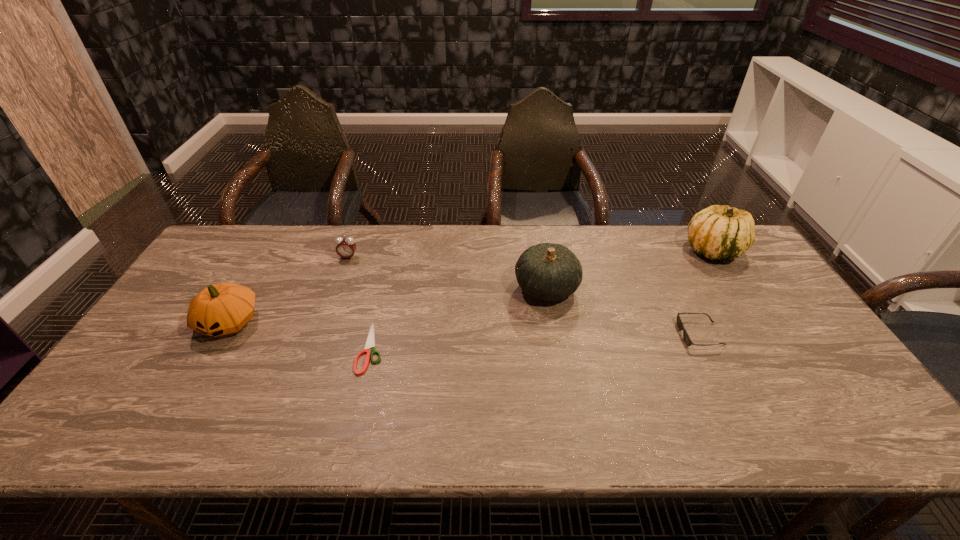
Identify the location of free space located on the front of the second gourd from left to right. The width and height of the screenshot is (960, 540). (557, 349).

Find the location of a particular element. This screenshot has height=540, width=960. vacant space located on the side of the leftmost object with the carved face is located at coordinates (180, 406).

Find the location of a particular element. The image size is (960, 540). vacant space located 0.240m on the clock face of the fifth object from right to left is located at coordinates (327, 314).

Find the location of a particular element. The height and width of the screenshot is (540, 960). free space located on the front-facing side of the sunglasses is located at coordinates (576, 334).

This screenshot has width=960, height=540. In order to click on free space located 0.150m on the front-facing side of the sunglasses in this screenshot , I will do `click(625, 334)`.

You are a GUI agent. You are given a task and a screenshot of the screen. Output one action in this format:
    pyautogui.click(x=<x>, y=<y>)
    Task: Click on the blank space located 0.270m on the front-facing side of the sunglasses
    This screenshot has height=540, width=960.
    Given the screenshot: What is the action you would take?
    pyautogui.click(x=580, y=334)

Image resolution: width=960 pixels, height=540 pixels. Identify the location of vacant space located on the right of the shortest object. (441, 348).

This screenshot has height=540, width=960. In order to click on alarm clock present at the far edge in this screenshot , I will do `click(346, 247)`.

The image size is (960, 540). What are the coordinates of `object that is at the left edge` in the screenshot? It's located at (224, 308).

The height and width of the screenshot is (540, 960). Find the location of `object present at the right edge`. object present at the right edge is located at coordinates (718, 232).